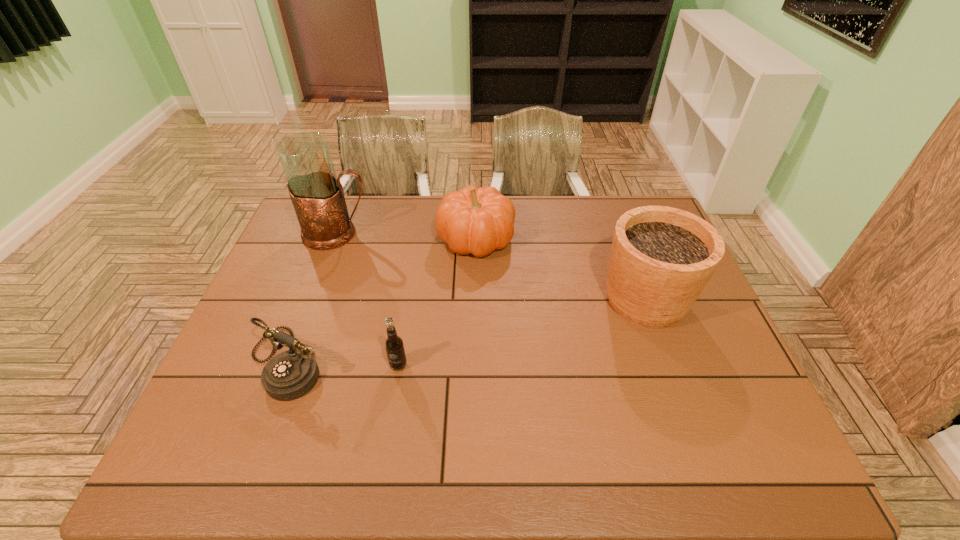
The height and width of the screenshot is (540, 960). Find the location of `free space between the fourth object from left to right and the tallest object`. free space between the fourth object from left to right and the tallest object is located at coordinates point(407,237).

Identify the location of object that is the closest to the telephone. The width and height of the screenshot is (960, 540). (394, 346).

Identify which object is located as the third nearest to the shortest object. Please provide its 2D coordinates. Your answer should be formatted as a tuple, i.e. [(x, y)], where the tuple contains the x and y coordinates of a point satisfying the conditions above.

[(474, 220)]

Locate an element on the screen. free space that satisfies the following two spatial constraints: 1. with the handle on the side of the tallest object; 2. on the front side of the shortest object is located at coordinates (290, 361).

Locate an element on the screen. Image resolution: width=960 pixels, height=540 pixels. vacant point that satisfies the following two spatial constraints: 1. on the back side of the pumpkin; 2. on the left side of the shortest object is located at coordinates (335, 239).

Where is `vacant space that satisfies the following two spatial constraints: 1. on the front side of the fourth object from left to right; 2. on the right side of the fourth shortest object`? The image size is (960, 540). vacant space that satisfies the following two spatial constraints: 1. on the front side of the fourth object from left to right; 2. on the right side of the fourth shortest object is located at coordinates (475, 300).